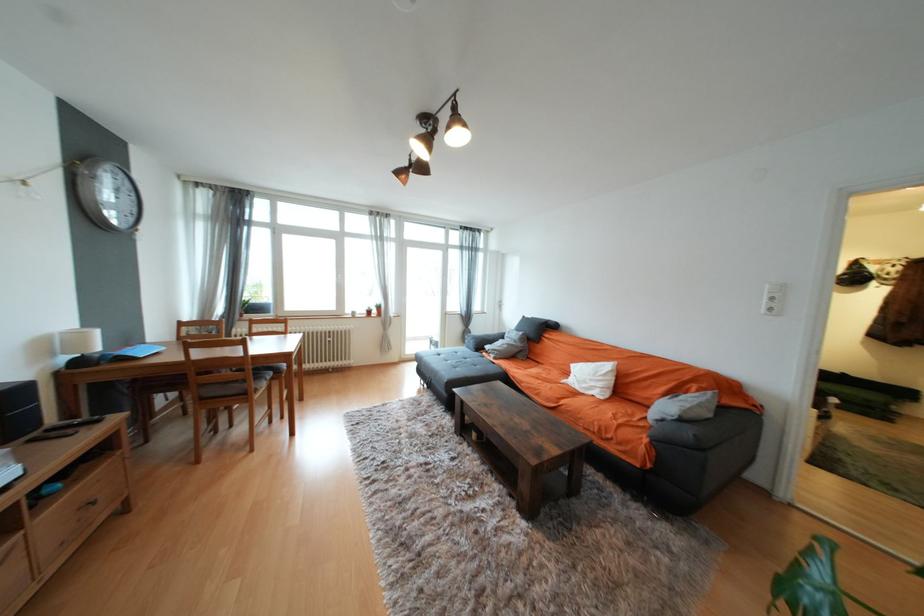
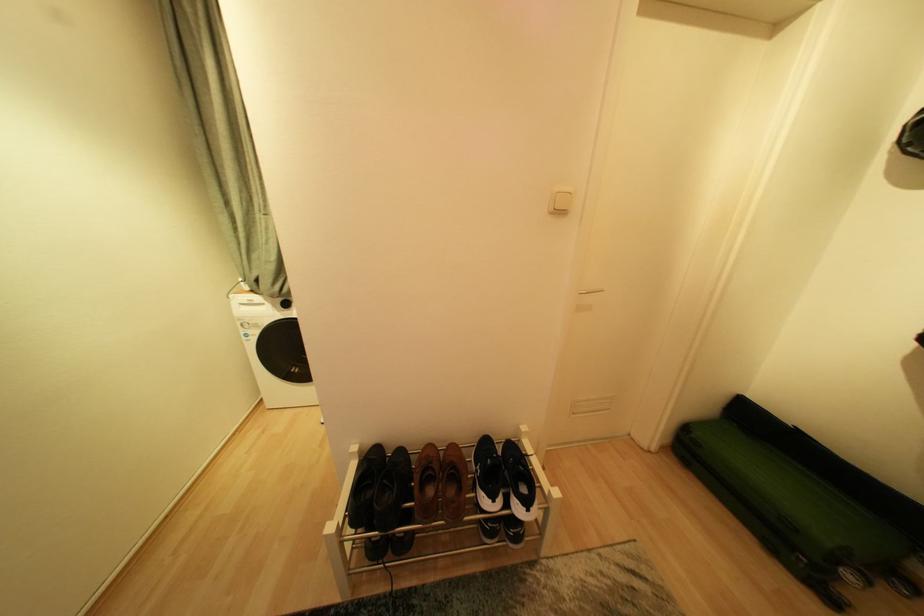
In the second image, find the point that corresponds to (896,422) in the first image.

(834, 599)